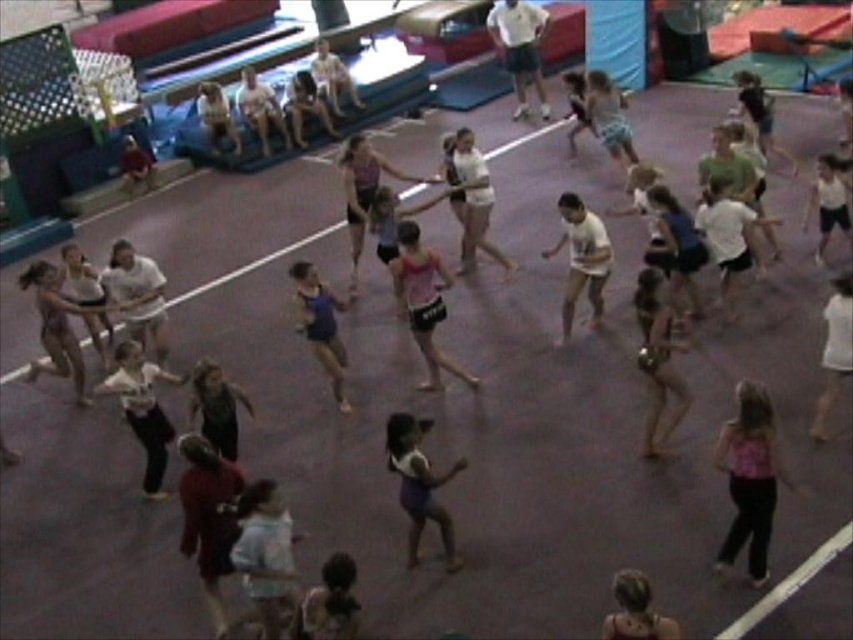
You are standing at the entrance of the gymnasium and see the light blue fabric at center. If you walk straight towards it, will you reach it before the purple floor ends?

The light blue fabric at center is positioned at point [265,554], which is within the gymnasium, so yes, walking straight towards it from the entrance will reach it before the purple floor ends.

You are a photographer standing at the entrance of the gymnasium. You need to capture a photo that includes both the light blue fabric at center and the matte blue tank top at center. If your camera has a maximum focus range of 8 feet, will you be able to include both subjects in the same frame without moving closer?

The distance between the light blue fabric at center and the matte blue tank top at center is 8.09 feet. Since the camera can only focus up to 8 feet, it may not be able to capture both subjects clearly in the same frame without moving closer.